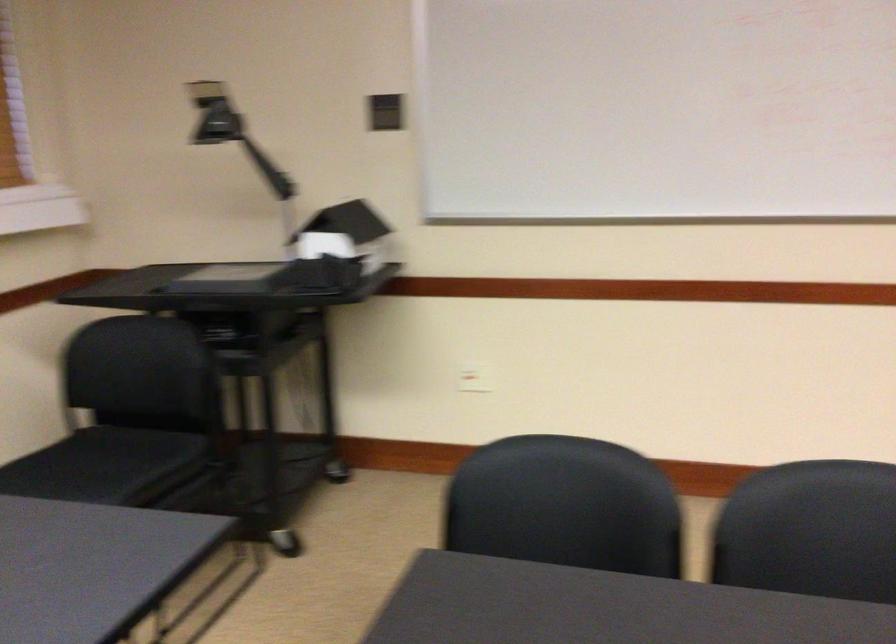
Find where to adjust the projector head. Please return your answer as a coordinate pair (x, y).

(213, 114)